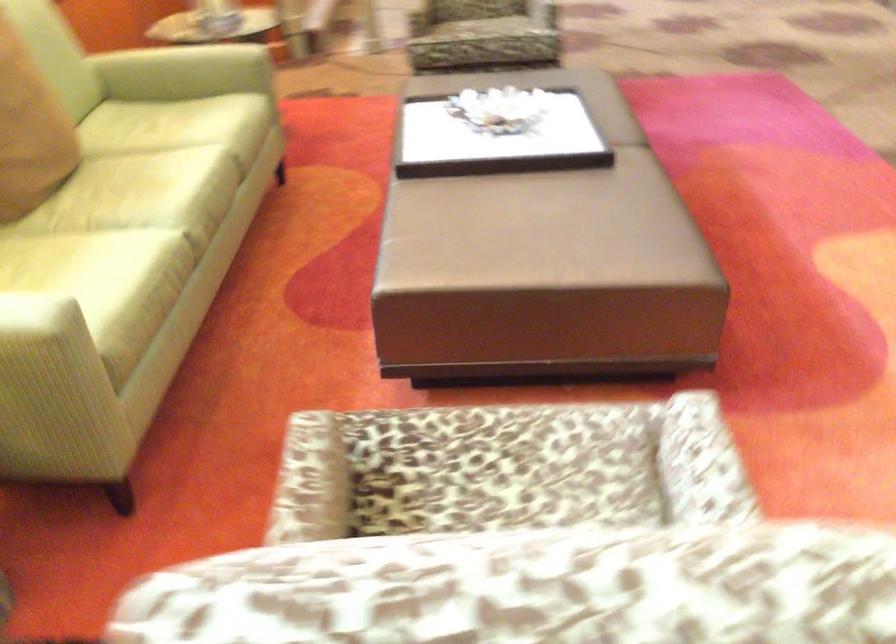
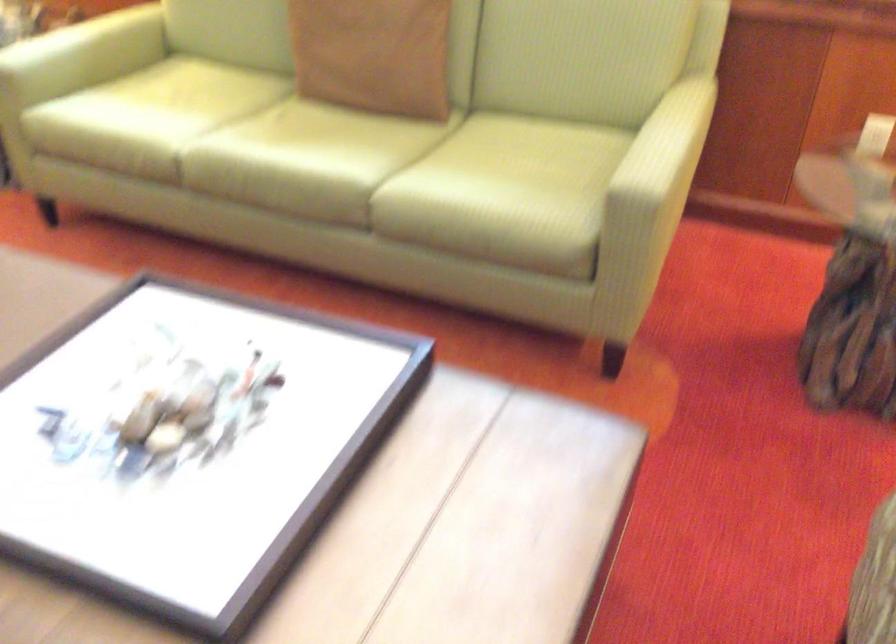
Question: I am providing you with two images of the same scene from different viewpoints. Please identify which objects are invisible in image2.

Choices:
 (A) sofa armrest
 (B) sofa sitting surface
 (C) brown pillow
 (D) white brush handle

Answer: (A)